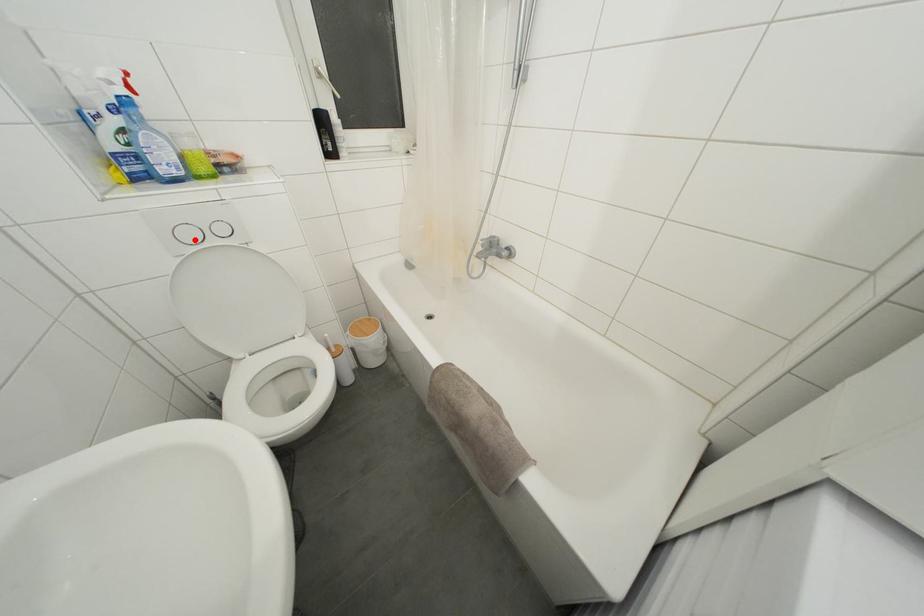
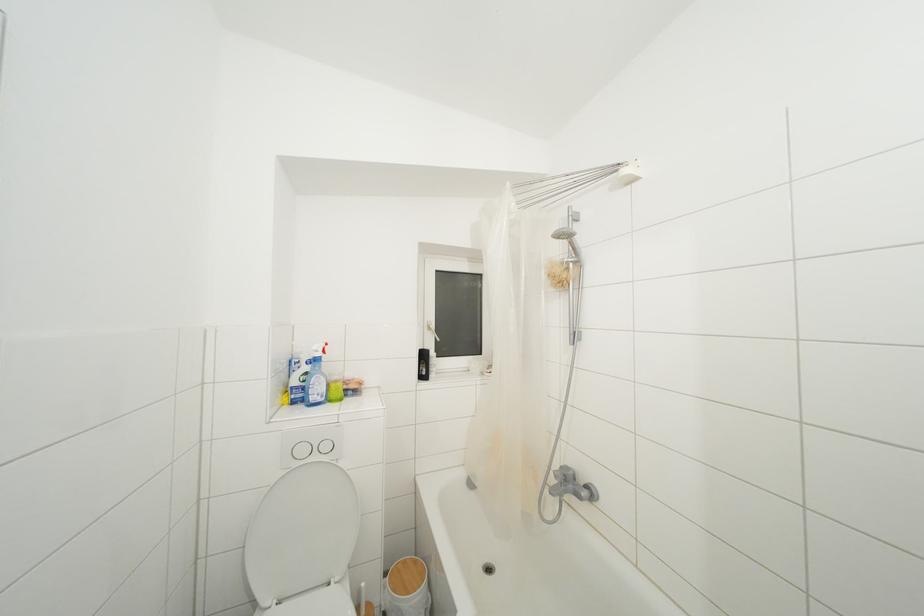
The point at the highlighted location is marked in the first image. Where is the corresponding point in the second image?

(307, 456)